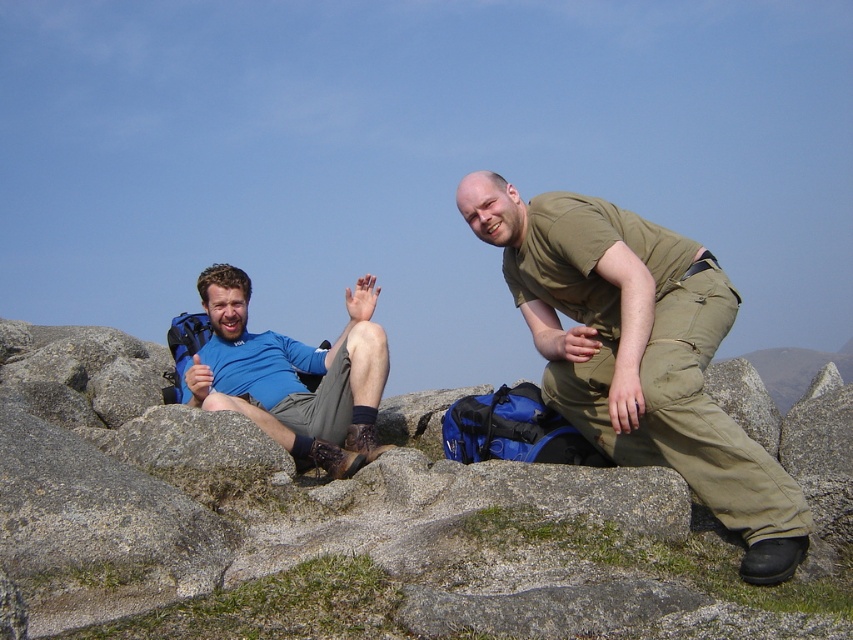
Can you confirm if olive green fabric pants at center is smaller than blue fabric shirt at left?

Incorrect, olive green fabric pants at center is not smaller in size than blue fabric shirt at left.

Identify the location of olive green fabric pants at center. (637, 353).